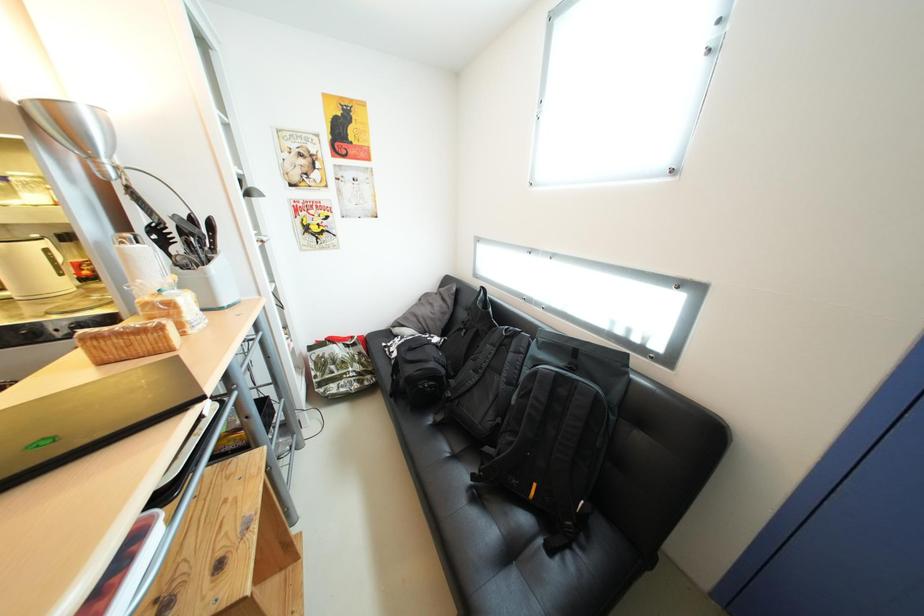
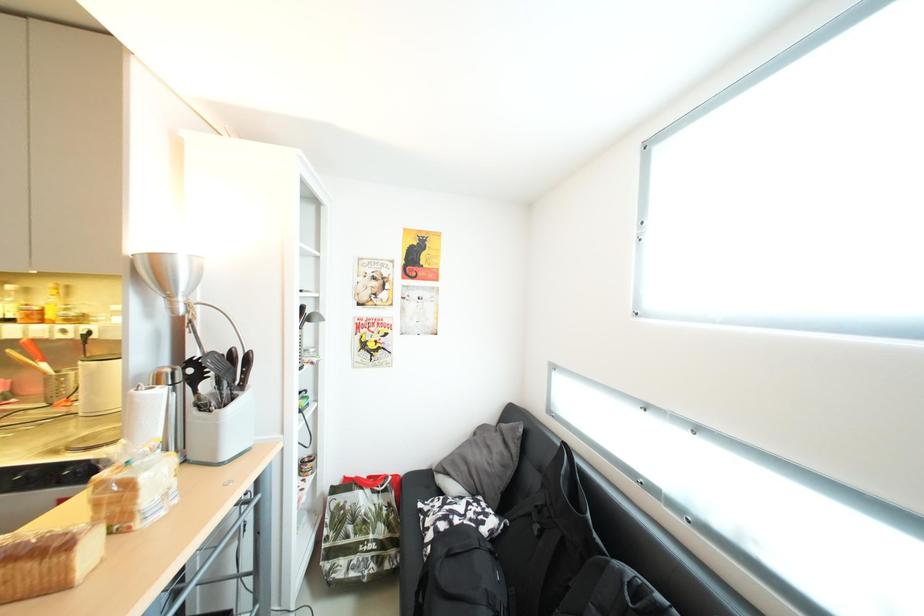
The first image is from the beginning of the video and the second image is from the end. How did the camera likely rotate when shooting the video?

The camera's rotation is toward left-up.